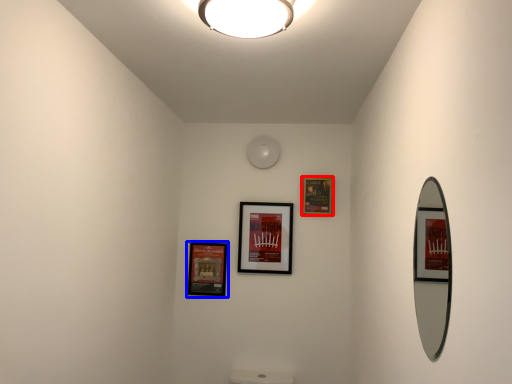
Question: Which object appears closest to the camera in this image, picture frame (highlighted by a red box) or picture frame (highlighted by a blue box)?

Choices:
 (A) picture frame
 (B) picture frame

Answer: (A)